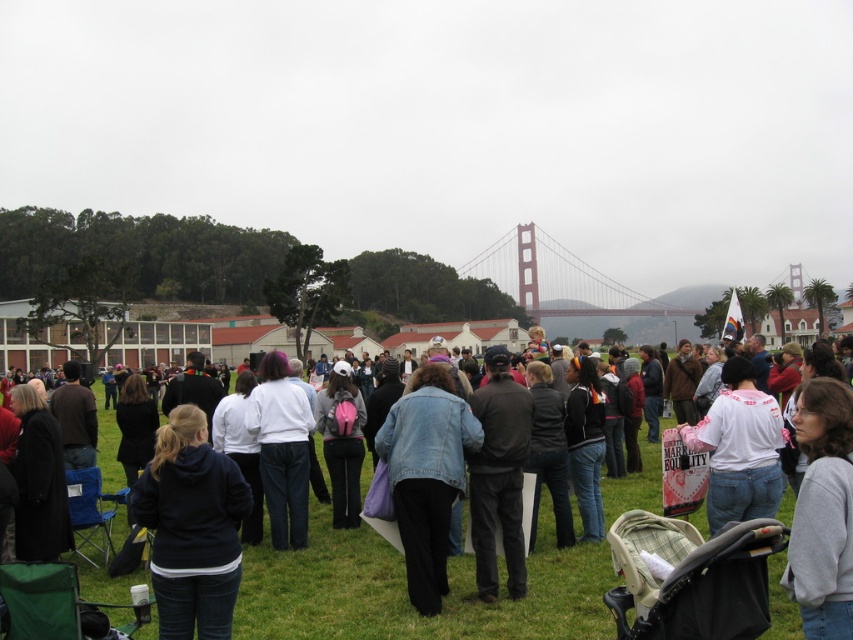
Question: Among these objects, which one is farthest from the camera?

Choices:
 (A) green grass at center
 (B) white matte shirt at center
 (C) denim jacket at center
 (D) white matte jacket at center

Answer: (D)

Question: Which object is the farthest from the black fleece jacket at lower left?

Choices:
 (A) denim jacket at center
 (B) white matte shirt at center
 (C) green grass at center

Answer: (B)

Question: Which point appears closest to the camera in this image?

Choices:
 (A) (728, 520)
 (B) (280, 406)
 (C) (583, 634)
 (D) (178, 554)

Answer: (D)

Question: Can you confirm if denim jacket at center is positioned below white matte shirt at center?

Choices:
 (A) no
 (B) yes

Answer: (B)

Question: Is black fleece jacket at lower left bigger than white matte jacket at center?

Choices:
 (A) no
 (B) yes

Answer: (A)

Question: Can you confirm if denim jacket at center is positioned to the left of white matte shirt at center?

Choices:
 (A) yes
 (B) no

Answer: (A)